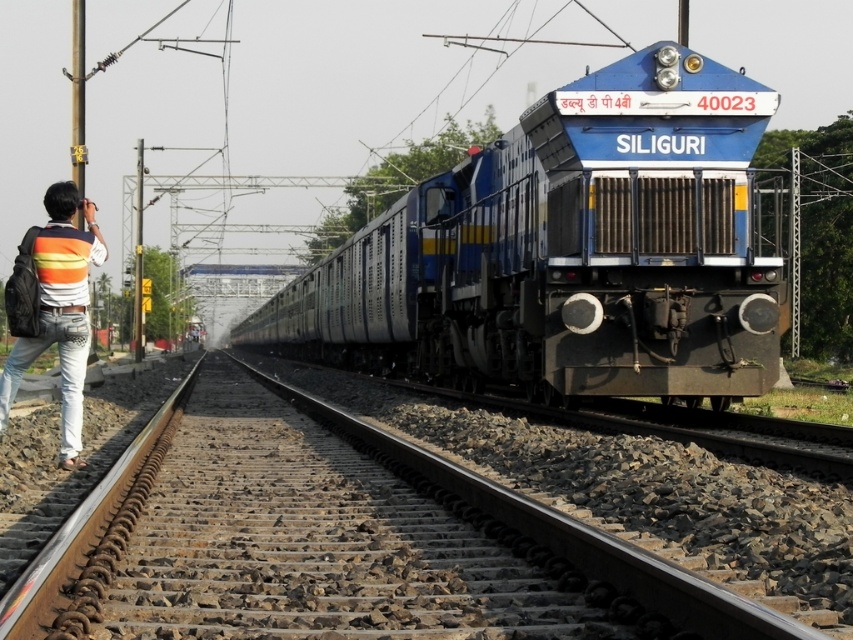
Question: Which point is closer to the camera?

Choices:
 (A) (363, 356)
 (B) (68, 308)
 (C) (351, 477)

Answer: (B)

Question: Is blue metallic train at center below brown gravel train track at center?

Choices:
 (A) no
 (B) yes

Answer: (A)

Question: Which of these objects is positioned closest to the striped sweater at left?

Choices:
 (A) brown gravel train track at center
 (B) blue metallic train at center

Answer: (A)

Question: Is blue metallic train at center positioned behind striped sweater at left?

Choices:
 (A) yes
 (B) no

Answer: (A)

Question: Is blue metallic train at center below brown gravel train track at center?

Choices:
 (A) no
 (B) yes

Answer: (A)

Question: Which point is closer to the camera?

Choices:
 (A) (42, 618)
 (B) (618, 234)

Answer: (A)